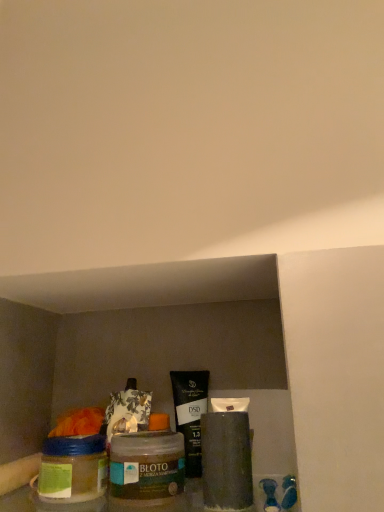
Question: Is matte black tube at center in front of or behind translucent glass jar at lower left in the image?

Choices:
 (A) front
 (B) behind

Answer: (A)

Question: Would you say matte black tube at center is to the left or to the right of translucent glass jar at lower left in the picture?

Choices:
 (A) left
 (B) right

Answer: (B)

Question: Based on their relative distances, which object is farther from the matte black tube at center?

Choices:
 (A) black matte tube at center
 (B) translucent glass jar at lower left

Answer: (B)

Question: Which is nearer to the black matte tube at center?

Choices:
 (A) translucent glass jar at lower left
 (B) matte black tube at center

Answer: (B)